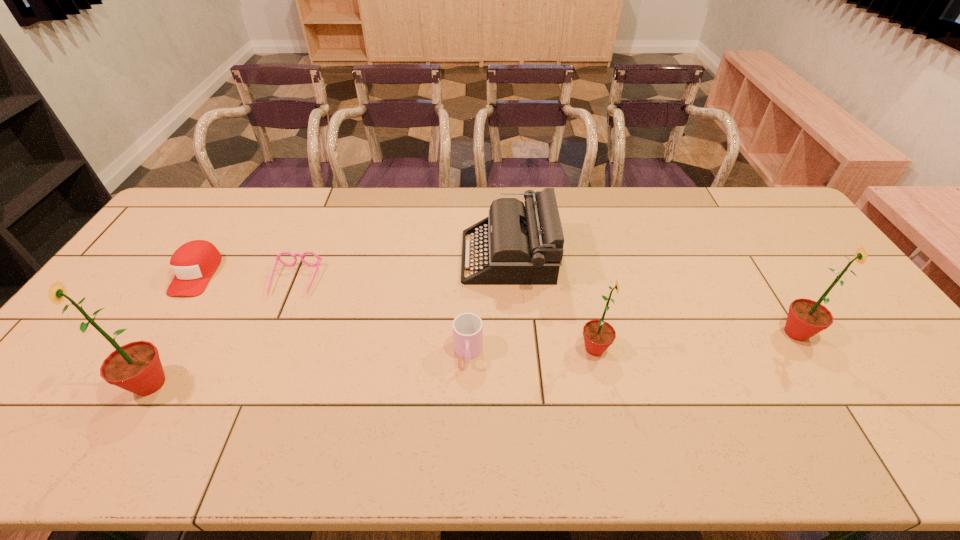
You are a GUI agent. You are given a task and a screenshot of the screen. Output one action in this format:
    pyautogui.click(x=<x>, y=<y>)
    Task: Click on the vacant space that's between the sixth object from left to right and the spectacles
    
    Given the screenshot: What is the action you would take?
    pyautogui.click(x=445, y=315)

What are the coordinates of `free spot between the spectacles and the rightmost sunflower` in the screenshot? It's located at (545, 307).

You are a GUI agent. You are given a task and a screenshot of the screen. Output one action in this format:
    pyautogui.click(x=<x>, y=<y>)
    Task: Click on the vacant space that's between the spectacles and the cup
    
    Given the screenshot: What is the action you would take?
    coord(382,317)

The image size is (960, 540). I want to click on vacant space that's between the fourth tallest object and the fifth shortest object, so click(x=551, y=303).

The height and width of the screenshot is (540, 960). I want to click on free spot between the baseball cap and the rightmost object, so click(x=496, y=303).

At what (x,y) coordinates should I click in order to perform the action: click on vacant space that is in between the second object from right to left and the fifth object from right to left. Please return your answer as a coordinate pair (x, y). This screenshot has height=540, width=960. Looking at the image, I should click on (445, 315).

What are the coordinates of `blank region between the fourth tallest object and the second shortest sunflower` in the screenshot? It's located at (652, 295).

Identify the location of vacant space that's between the nearest sunflower and the shortest object. This screenshot has width=960, height=540. (223, 332).

At what (x,y) coordinates should I click in order to perform the action: click on the third closest object to the second sunflower from right to left. Please return your answer as a coordinate pair (x, y). The image size is (960, 540). Looking at the image, I should click on [x=806, y=318].

Identify which object is the closest to the shortest object. Please provide its 2D coordinates. Your answer should be formatted as a tuple, i.e. [(x, y)], where the tuple contains the x and y coordinates of a point satisfying the conditions above.

[(193, 263)]